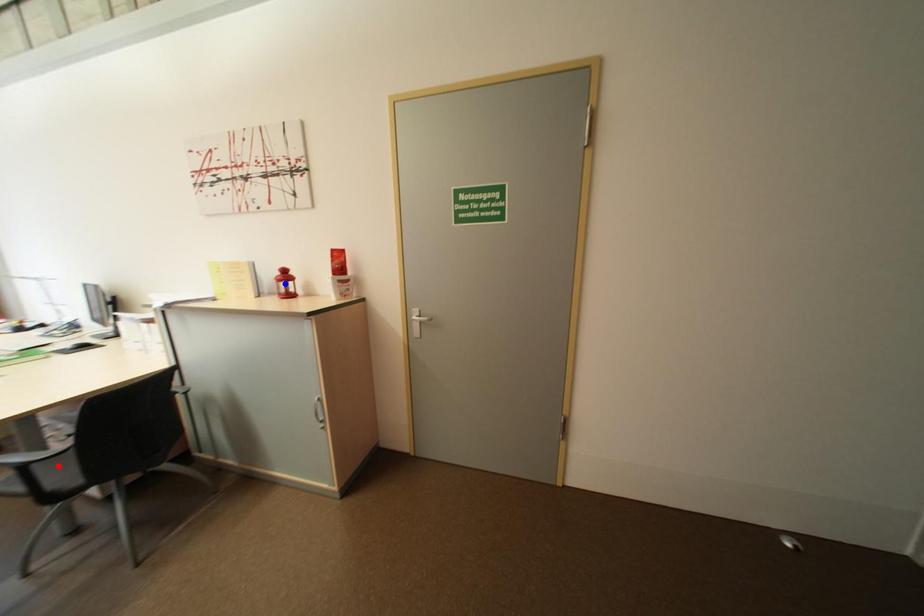
Question: Which of the two points in the image is closer to the camera?

Choices:
 (A) Blue point is closer.
 (B) Red point is closer.

Answer: (B)